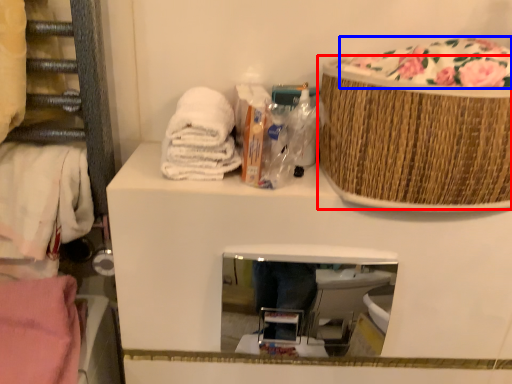
Question: Which point is closer to the camera, basket (highlighted by a red box) or food (highlighted by a blue box)?

Choices:
 (A) basket
 (B) food

Answer: (A)